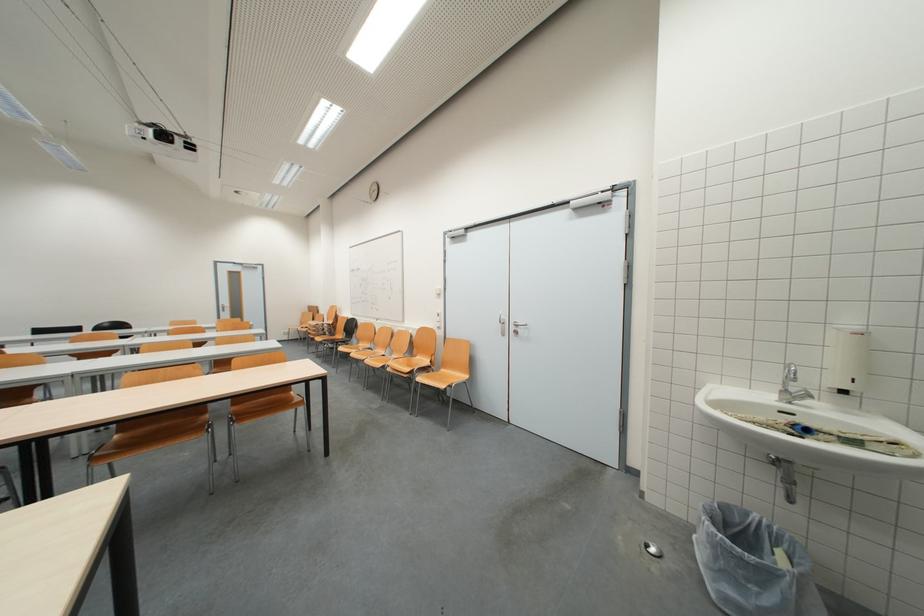
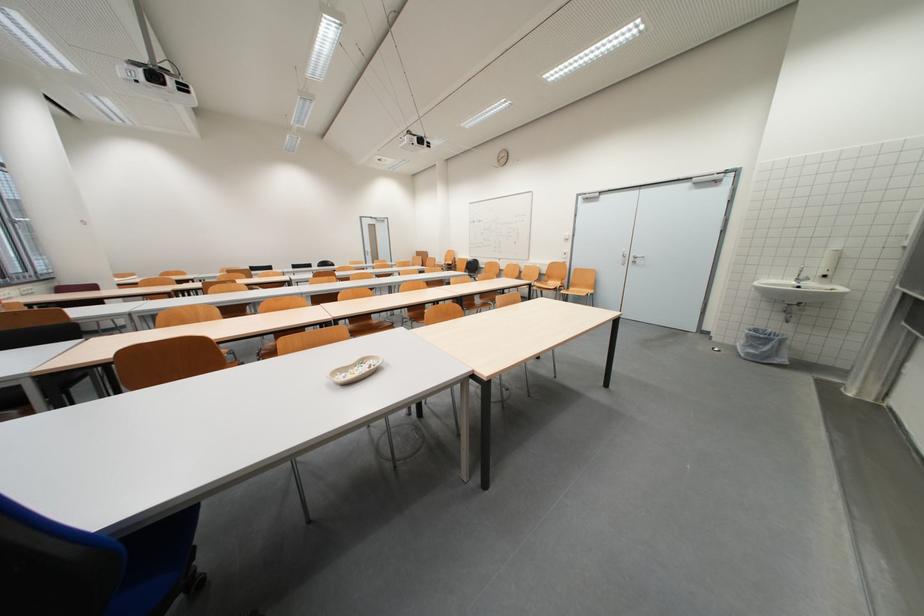
The images are taken continuously from a first-person perspective. In which direction are you moving?

The movement direction of the cameraman is left, backward.